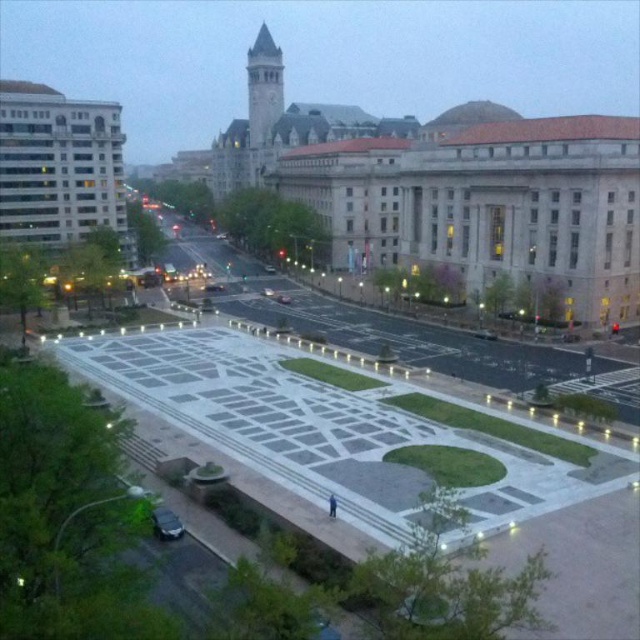
You are standing at the edge of the plaza and want to walk towards the shiny black sedan at lower left. As you walk, will the gray stone clock tower at upper center appear to get closer or farther away?

The gray stone clock tower at upper center is further to the viewer than the shiny black sedan at lower left. As you walk towards the sedan, the clock tower will appear to get farther away because it is behind the sedan relative to your position.

You are standing at the center of the plaza in the cityscape image. Looking towards the gray stone clock tower at upper center, which direction should you walk to reach it?

The gray stone clock tower at upper center is located at point (262,86) in the image, so you should walk towards the upper center direction to reach it.

You are a pedestrian standing at the shiny black sedan at lower left. Looking towards the gray stone clock tower at upper center, will you see it to your right or left?

The gray stone clock tower at upper center is to the left of the shiny black sedan at lower left, so from the sedan, the clock tower would be seen to your right.